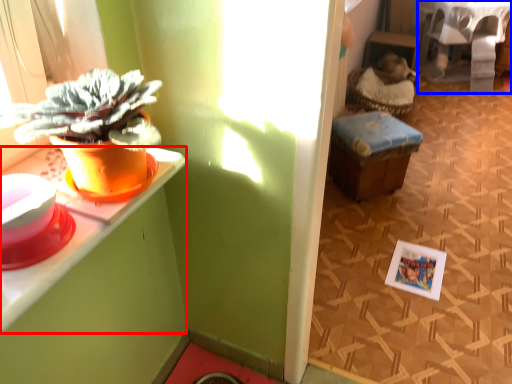
Question: Which of the following is the farthest to the observer, desk (highlighted by a red box) or table (highlighted by a blue box)?

Choices:
 (A) desk
 (B) table

Answer: (B)